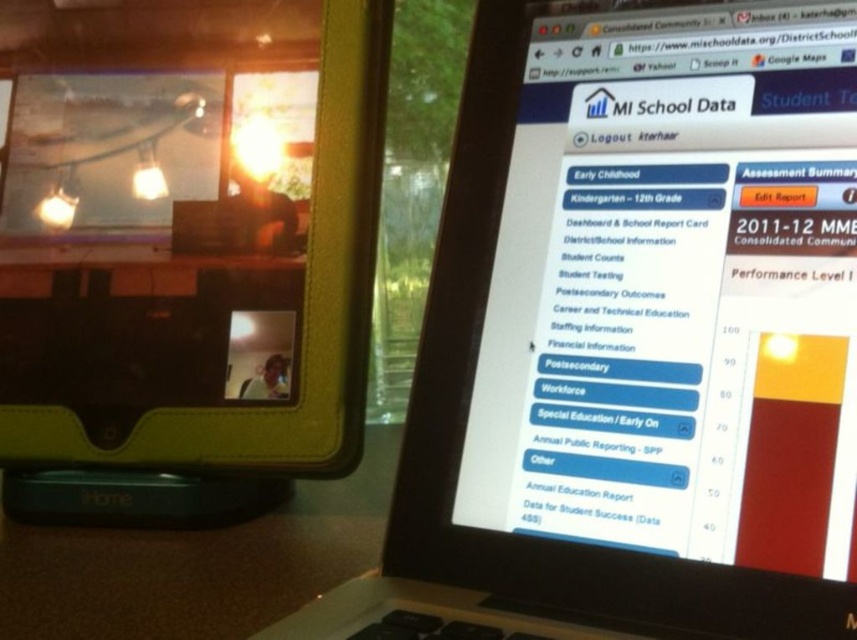
Question: Which of the following is the farthest from the observer?

Choices:
 (A) black matte laptop at upper right
 (B) matte black tablet at upper left

Answer: (B)

Question: Which point appears closest to the camera in this image?

Choices:
 (A) (806, 205)
 (B) (13, 115)

Answer: (A)

Question: Among these points, which one is nearest to the camera?

Choices:
 (A) (184, 198)
 (B) (682, 525)

Answer: (B)

Question: Can you confirm if black matte laptop at upper right is smaller than matte black tablet at upper left?

Choices:
 (A) no
 (B) yes

Answer: (A)

Question: Considering the relative positions of black matte laptop at upper right and matte black tablet at upper left in the image provided, where is black matte laptop at upper right located with respect to matte black tablet at upper left?

Choices:
 (A) left
 (B) right

Answer: (B)

Question: Does black matte laptop at upper right lie in front of matte black tablet at upper left?

Choices:
 (A) no
 (B) yes

Answer: (B)